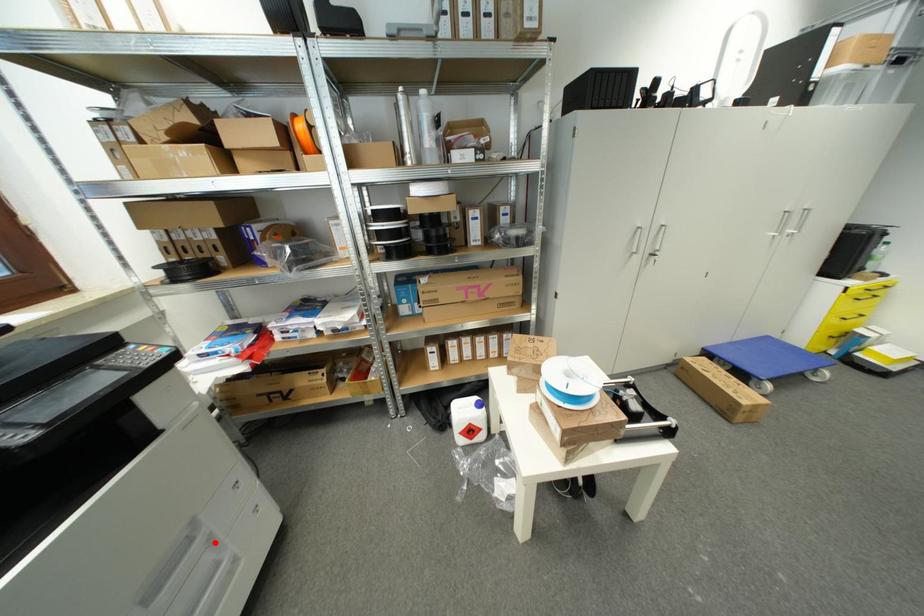
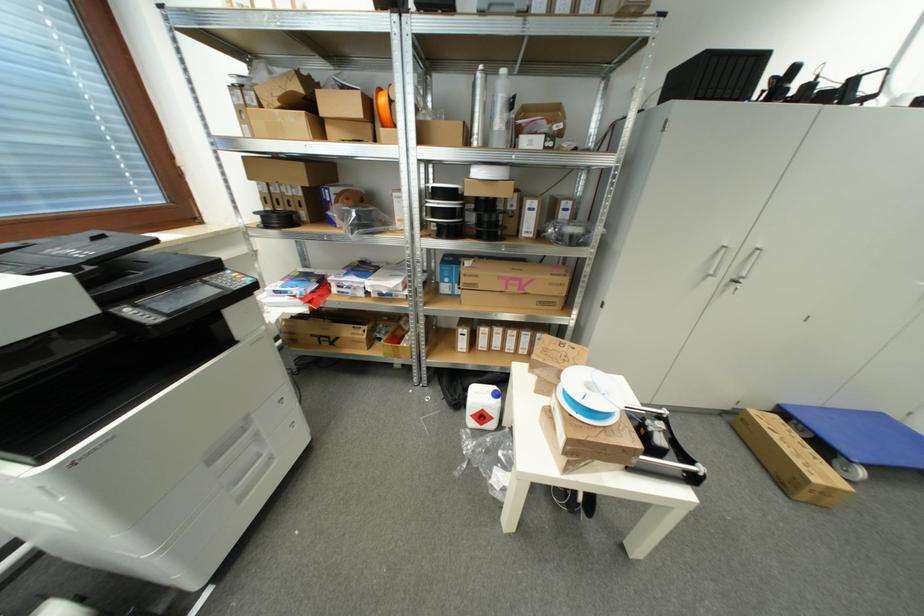
Question: I am providing you with two images of the same scene from different viewpoints. A red point is shown in image1. For the corresponding object point in image2, is it positioned nearer or farther from the camera?

Choices:
 (A) Nearer
 (B) Farther

Answer: (B)